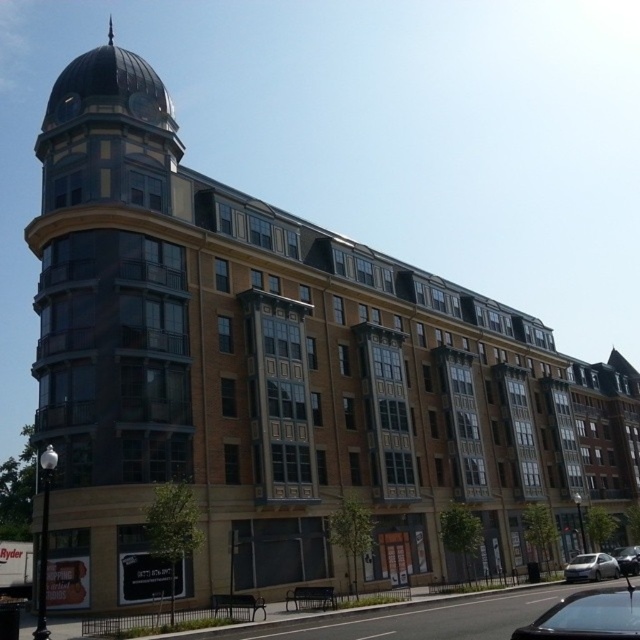
Question: Which point is closer to the camera?

Choices:
 (A) (625, 570)
 (B) (564, 568)
 (C) (620, 595)

Answer: (C)

Question: Is shiny black car at lower right to the left of satin silver sedan at lower right from the viewer's perspective?

Choices:
 (A) yes
 (B) no

Answer: (A)

Question: Can you confirm if satin silver sedan at lower right is positioned above shiny silver sedan at lower right?

Choices:
 (A) no
 (B) yes

Answer: (A)

Question: Which object appears closest to the camera in this image?

Choices:
 (A) shiny black car at lower right
 (B) satin silver sedan at lower right

Answer: (A)

Question: Among these objects, which one is nearest to the camera?

Choices:
 (A) shiny black car at lower right
 (B) shiny silver sedan at lower right

Answer: (A)

Question: Is shiny black car at lower right to the right of satin silver sedan at lower right from the viewer's perspective?

Choices:
 (A) yes
 (B) no

Answer: (B)